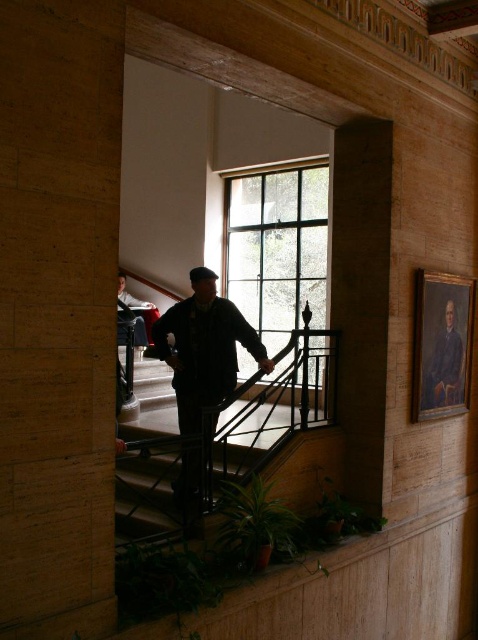
You are a delivery person who needs to place a package between the dark green fabric jacket at center and the dark blue jeans at lower left. Can you fit the package, which is 3 meters long, between them?

The distance between the dark green fabric jacket at center and the dark blue jeans at lower left is 3.25 meters, so yes, the package can fit as it is shorter than the available space.

You are an interior designer assessing the layout of this historical building. You need to determine the spatial relationship between the dark green fabric jacket at center and the oil painting at upper right. Which object is located to the left of the other?

The dark green fabric jacket at center is positioned on the left side of oil painting at upper right.